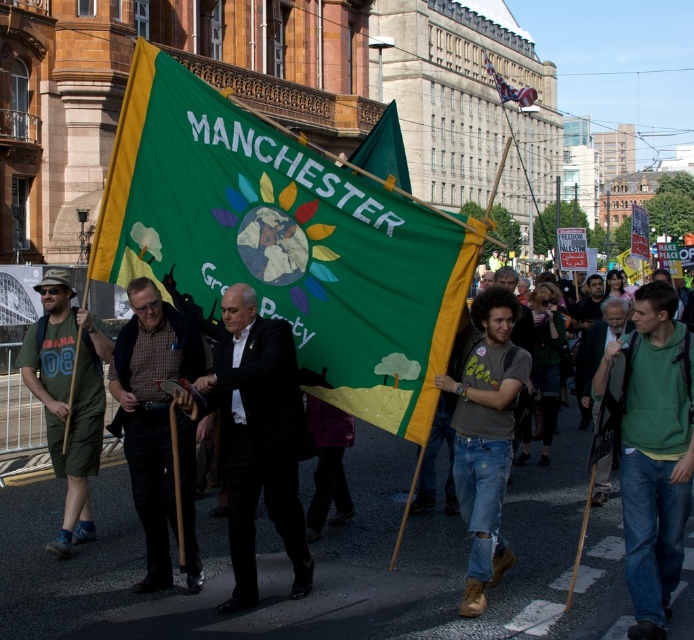
You are a photographer standing in the middle of the protest scene. You want to take a photo of the green cotton hoodie at lower right. What is the exact 2D coordinate point where you should focus your camera?

The exact 2D coordinate point for the green cotton hoodie at lower right is (652,452).

You are a photographer standing at the edge of the protest crowd. You want to capture a clear photo of the green cotton hoodie at lower right without including any other protesters in the frame. Given that your camera has a minimum focusing distance of 20 feet, can you take the photo from your current position?

The green cotton hoodie at lower right is 20.43 feet away from the camera. Since your camera can focus as close as 20 feet, you can take the photo from your current position because the distance is within the camera minimum focusing distance.